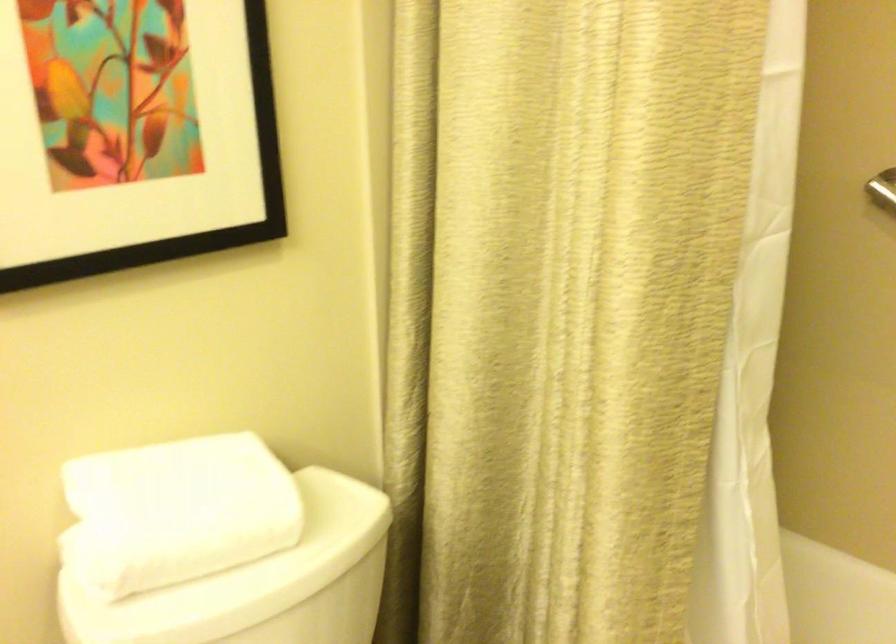
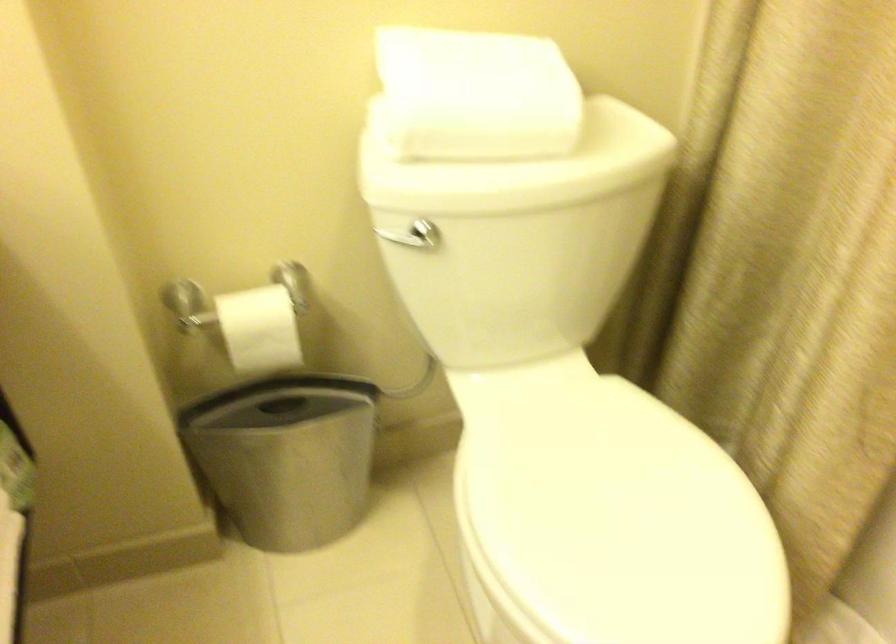
Find the pixel in the second image that matches the point at 252,574 in the first image.

(519, 167)